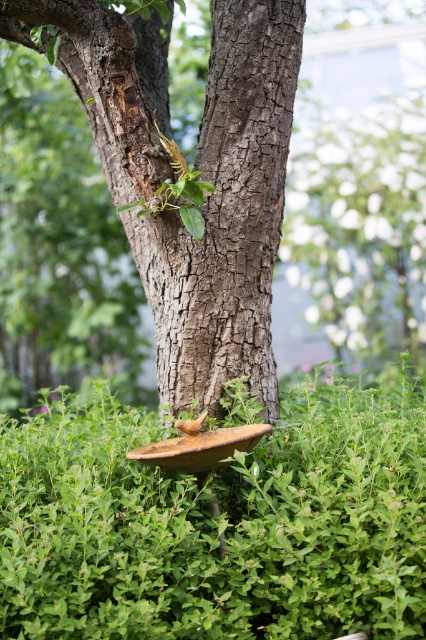
Can you confirm if green leafy hedge at lower center is shorter than rough bark tree trunk at center?

Yes, green leafy hedge at lower center is shorter than rough bark tree trunk at center.

Can you confirm if green leafy hedge at lower center is bigger than rough bark tree trunk at center?

No, green leafy hedge at lower center is not bigger than rough bark tree trunk at center.

Is point (290, 442) positioned behind point (244, 29)?

No, (290, 442) is in front of (244, 29).

Locate an element on the screen. Image resolution: width=426 pixels, height=640 pixels. green leafy hedge at lower center is located at coordinates (215, 524).